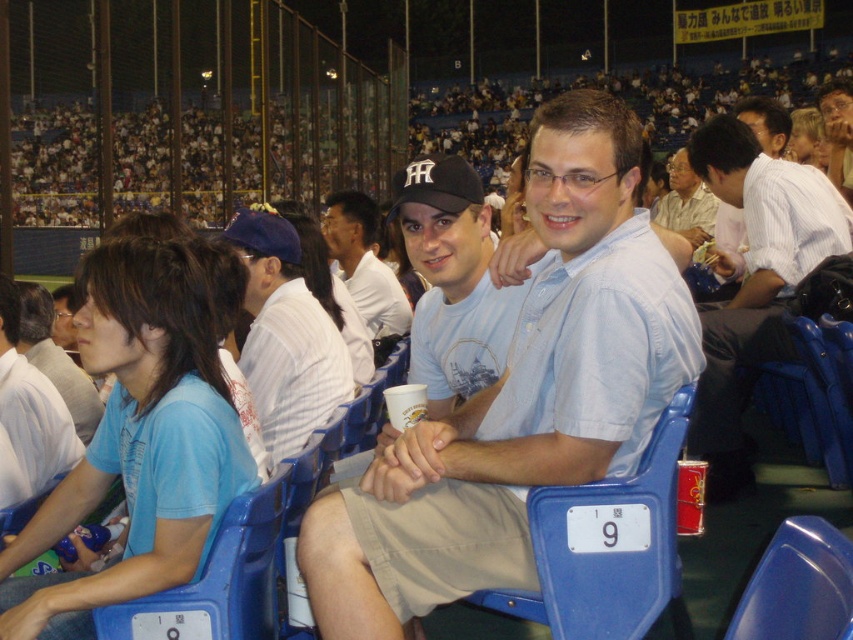
Is point (241, 541) more distant than point (352, 259)?

No.

Can you confirm if blue plastic chair at lower left is wider than white cotton shirt at center?

In fact, blue plastic chair at lower left might be narrower than white cotton shirt at center.

Is point (206, 604) in front of point (340, 211)?

Yes.

This screenshot has height=640, width=853. In order to click on blue plastic chair at lower left in this screenshot , I will do `click(218, 580)`.

Is blue cotton shirt at left behind matte white shirt at center?

No, it is not.

Between blue cotton shirt at left and matte white shirt at center, which one has less height?

With less height is blue cotton shirt at left.

Does point (50, 468) come closer to viewer compared to point (691, 232)?

That is True.

Identify the location of blue cotton shirt at left. This screenshot has width=853, height=640. (28, 412).

Can you confirm if light blue cotton shirt at center is wider than white striped shirt at center?

Indeed, light blue cotton shirt at center has a greater width compared to white striped shirt at center.

Measure the distance between point (593, 429) and camera.

Point (593, 429) is 6.79 feet from camera.

Locate an element on the screen. The width and height of the screenshot is (853, 640). light blue cotton shirt at center is located at coordinates point(520,397).